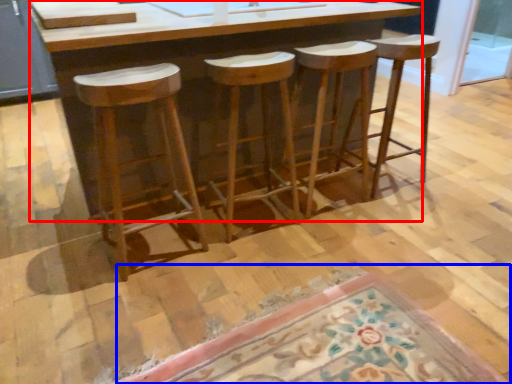
Question: Which point is closer to the camera, counter (highlighted by a red box) or doormat (highlighted by a blue box)?

Choices:
 (A) counter
 (B) doormat

Answer: (B)